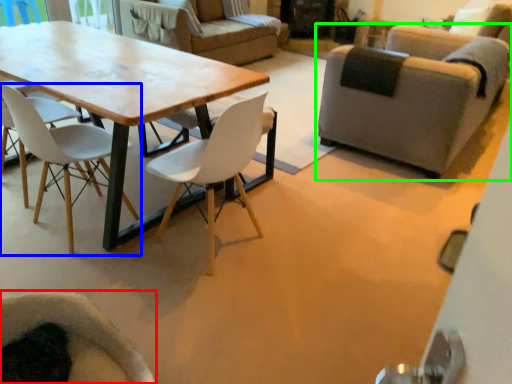
Question: Based on their relative distances, which object is nearer to chair (highlighted by a red box)? Choose from chair (highlighted by a blue box) and chair (highlighted by a green box).

Choices:
 (A) chair
 (B) chair

Answer: (A)